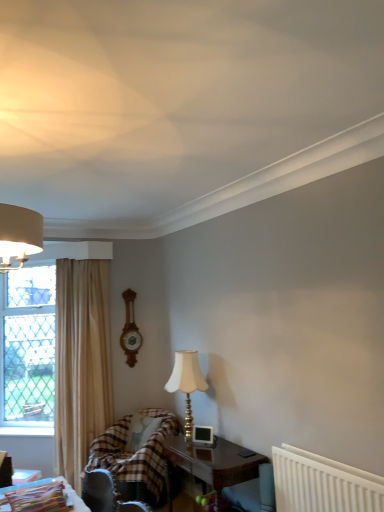
Question: Are white plastic radiator at lower right and dark wood table at lower center, the second table viewed from the top, located far from each other?

Choices:
 (A) no
 (B) yes

Answer: (A)

Question: Is white plastic radiator at lower right smaller than dark wood table at lower center, marked as the 2th table in a front-to-back arrangement?

Choices:
 (A) yes
 (B) no

Answer: (A)

Question: From a real-world perspective, is white plastic radiator at lower right on dark wood table at lower center, which is the second table in left-to-right order?

Choices:
 (A) yes
 (B) no

Answer: (A)

Question: Considering the relative sizes of white plastic radiator at lower right and dark wood table at lower center, the second table viewed from the top, in the image provided, is white plastic radiator at lower right bigger than dark wood table at lower center, the second table viewed from the top,?

Choices:
 (A) no
 (B) yes

Answer: (A)

Question: Considering the relative sizes of white plastic radiator at lower right and dark wood table at lower center, the second table viewed from the top, in the image provided, is white plastic radiator at lower right thinner than dark wood table at lower center, the second table viewed from the top,?

Choices:
 (A) yes
 (B) no

Answer: (A)

Question: Is point (349, 481) positioned closer to the camera than point (8, 392)?

Choices:
 (A) closer
 (B) farther

Answer: (A)

Question: Considering the positions of white plastic radiator at lower right and clear glass window at left in the image, is white plastic radiator at lower right bigger or smaller than clear glass window at left?

Choices:
 (A) big
 (B) small

Answer: (B)

Question: Considering the positions of white plastic radiator at lower right and clear glass window at left in the image, is white plastic radiator at lower right taller or shorter than clear glass window at left?

Choices:
 (A) tall
 (B) short

Answer: (B)

Question: Relative to clear glass window at left, is white plastic radiator at lower right in front or behind?

Choices:
 (A) front
 (B) behind

Answer: (A)

Question: Looking at their shapes, would you say wooden clock at center is wider or thinner than plastic magazine at lower left, which is counted as the 1th table, starting from the top?

Choices:
 (A) wide
 (B) thin

Answer: (B)

Question: From a real-world perspective, is wooden clock at center above or below plastic magazine at lower left, which is the second table in right-to-left order?

Choices:
 (A) below
 (B) above

Answer: (B)

Question: Is wooden clock at center in front of or behind plastic magazine at lower left, the 1th table positioned from the front, in the image?

Choices:
 (A) behind
 (B) front

Answer: (A)

Question: From the image's perspective, is wooden clock at center positioned above or below plastic magazine at lower left, which is counted as the second table, starting from the back?

Choices:
 (A) above
 (B) below

Answer: (A)

Question: Would you say wooden clock at center is inside or outside beige fabric curtain at left?

Choices:
 (A) outside
 (B) inside

Answer: (A)

Question: Considering the positions of wooden clock at center and beige fabric curtain at left in the image, is wooden clock at center wider or thinner than beige fabric curtain at left?

Choices:
 (A) wide
 (B) thin

Answer: (B)